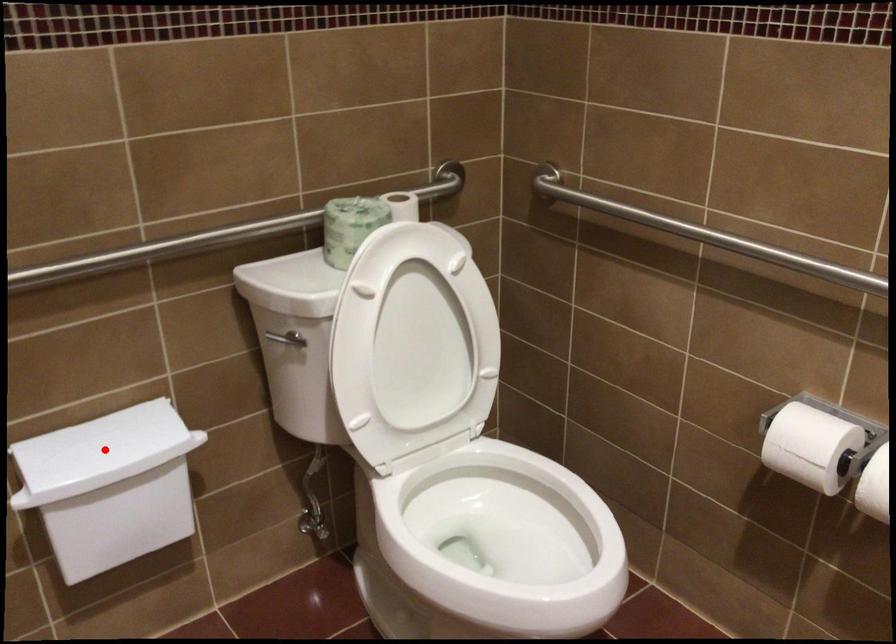
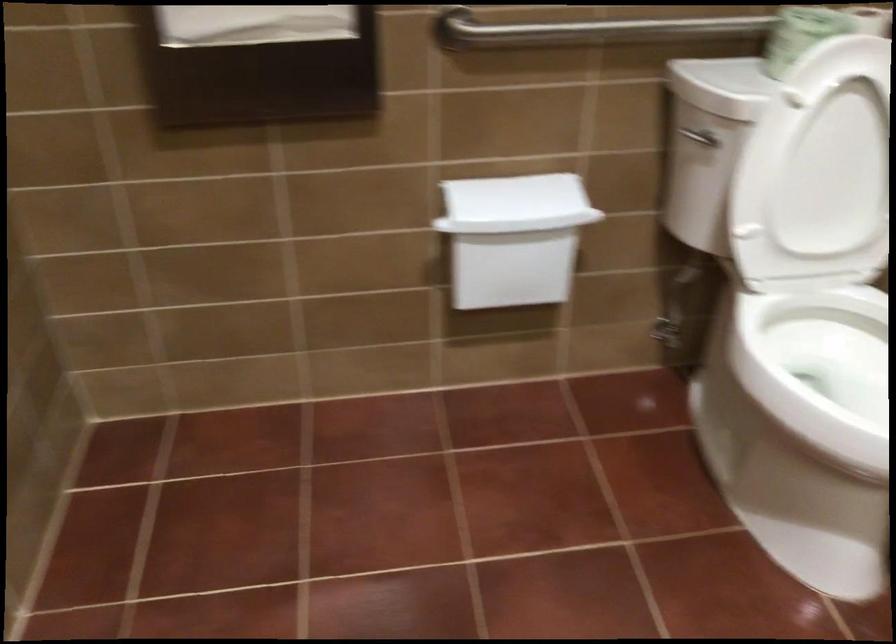
In the second image, find the point that corresponds to the highlighted location in the first image.

(513, 196)